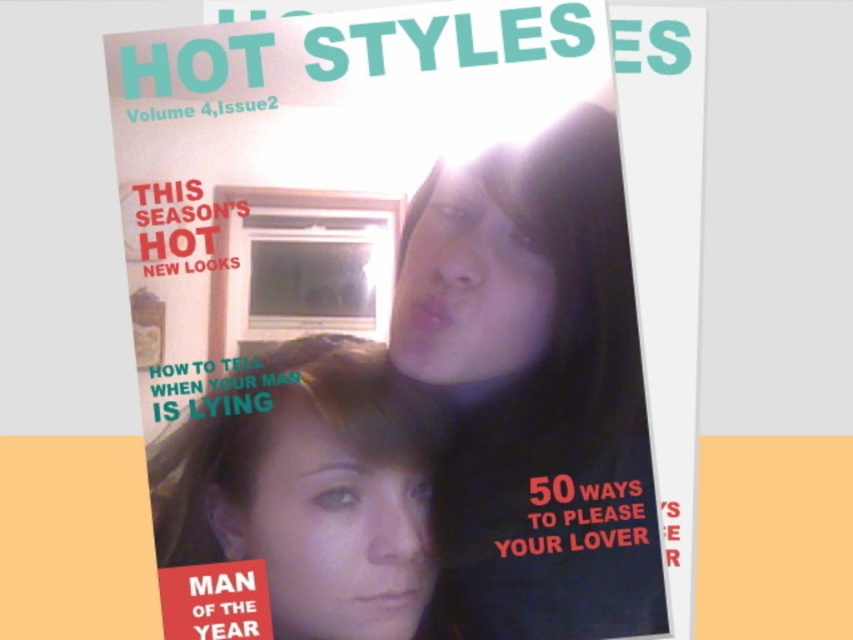
Question: Estimate the real-world distances between objects in this image. Which object is farther from the matte plastic magazine at center?

Choices:
 (A) smooth skin face at upper right
 (B) smooth skin face at center

Answer: (B)

Question: Can you confirm if smooth skin face at upper right is positioned below smooth skin face at center?

Choices:
 (A) yes
 (B) no

Answer: (B)

Question: Which is nearer to the smooth skin face at upper right?

Choices:
 (A) matte plastic magazine at center
 (B) smooth skin face at center

Answer: (A)

Question: Is smooth skin face at upper right smaller than smooth skin face at center?

Choices:
 (A) yes
 (B) no

Answer: (B)

Question: Is smooth skin face at upper right in front of smooth skin face at center?

Choices:
 (A) no
 (B) yes

Answer: (A)

Question: Which object appears closest to the camera in this image?

Choices:
 (A) smooth skin face at center
 (B) matte plastic magazine at center

Answer: (A)